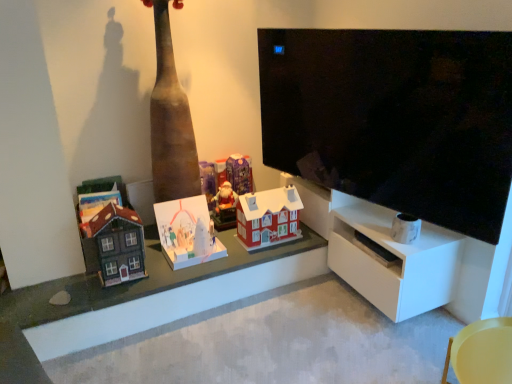
Question: Is yellow plastic chair at lower right oriented away from matte red plastic house at center, the first toy from the right?

Choices:
 (A) no
 (B) yes

Answer: (A)

Question: Does yellow plastic chair at lower right have a lesser height compared to matte red plastic house at center, the first toy from the right?

Choices:
 (A) yes
 (B) no

Answer: (A)

Question: Considering the relative sizes of yellow plastic chair at lower right and matte red plastic house at center, placed as the fifth toy when sorted from left to right, in the image provided, is yellow plastic chair at lower right smaller than matte red plastic house at center, placed as the fifth toy when sorted from left to right,?

Choices:
 (A) yes
 (B) no

Answer: (B)

Question: Does yellow plastic chair at lower right have a lesser width compared to matte red plastic house at center, the first toy from the right?

Choices:
 (A) no
 (B) yes

Answer: (A)

Question: Is yellow plastic chair at lower right to the right of matte red plastic house at center, the first toy from the right, from the viewer's perspective?

Choices:
 (A) no
 (B) yes

Answer: (B)

Question: From the image's perspective, is matte red plastic house at center, the first toy from the right, located above or below yellow plastic chair at lower right?

Choices:
 (A) above
 (B) below

Answer: (A)

Question: Relative to yellow plastic chair at lower right, is matte red plastic house at center, the first toy from the right, in front or behind?

Choices:
 (A) behind
 (B) front

Answer: (A)

Question: From their relative heights in the image, would you say matte red plastic house at center, the first toy from the right, is taller or shorter than yellow plastic chair at lower right?

Choices:
 (A) tall
 (B) short

Answer: (A)

Question: Considering the positions of matte red plastic house at center, placed as the fifth toy when sorted from left to right, and yellow plastic chair at lower right in the image, is matte red plastic house at center, placed as the fifth toy when sorted from left to right, wider or thinner than yellow plastic chair at lower right?

Choices:
 (A) wide
 (B) thin

Answer: (B)

Question: Do you think white cardboard advent calendar at center, the 2th toy in the left-to-right sequence, is within matte red plastic house at center, placed as the fifth toy when sorted from left to right, or outside of it?

Choices:
 (A) outside
 (B) inside

Answer: (A)

Question: From a real-world perspective, is white cardboard advent calendar at center, the 2th toy in the left-to-right sequence, above or below matte red plastic house at center, placed as the fifth toy when sorted from left to right?

Choices:
 (A) above
 (B) below

Answer: (B)

Question: In terms of height, does white cardboard advent calendar at center, marked as the 4th toy in a right-to-left arrangement, look taller or shorter compared to matte red plastic house at center, the first toy from the right?

Choices:
 (A) short
 (B) tall

Answer: (A)

Question: Visually, is white cardboard advent calendar at center, the 2th toy in the left-to-right sequence, positioned to the left or to the right of matte red plastic house at center, placed as the fifth toy when sorted from left to right?

Choices:
 (A) right
 (B) left

Answer: (B)

Question: Considering the positions of wooden toy houses at center and matte brown wooden house at left, which appears as the 5th toy when viewed from the right, in the image, is wooden toy houses at center bigger or smaller than matte brown wooden house at left, which appears as the 5th toy when viewed from the right,?

Choices:
 (A) big
 (B) small

Answer: (A)

Question: From the image's perspective, relative to matte brown wooden house at left, which appears as the 5th toy when viewed from the right, is wooden toy houses at center above or below?

Choices:
 (A) above
 (B) below

Answer: (B)